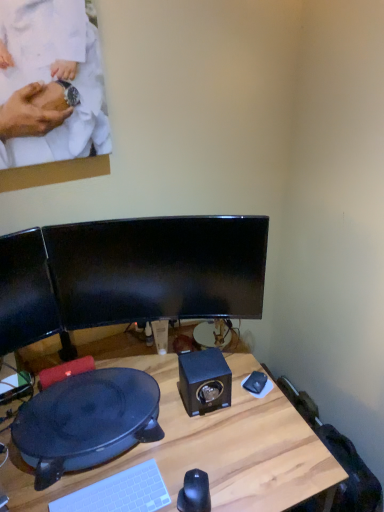
I want to click on vacant area that lies to the right of black plastic wok at lower left, so click(209, 438).